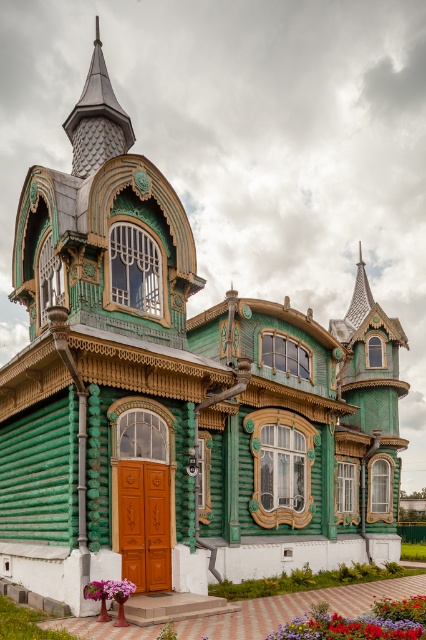
What do you see at coordinates (97, 120) in the screenshot?
I see `shiny dark gray spire at upper center` at bounding box center [97, 120].

Can you confirm if shiny dark gray spire at upper center is shorter than vivid red petals at lower center?

No, shiny dark gray spire at upper center is not shorter than vivid red petals at lower center.

Is point (83, 163) farther from camera compared to point (344, 624)?

Yes, it is behind point (344, 624).

What are the coordinates of `shiny dark gray spire at upper center` in the screenshot? It's located at (97, 120).

Does vivid red petals at lower center appear on the left side of pink matte flower at lower center?

In fact, vivid red petals at lower center is to the right of pink matte flower at lower center.

Is point (379, 605) closer to viewer compared to point (103, 589)?

No, (379, 605) is further to viewer.

Identify the location of vivid red petals at lower center. (359, 621).

Is shiny dark gray spire at upper center bigger than pink matte flower at lower center?

Yes.

The height and width of the screenshot is (640, 426). In order to click on shiny dark gray spire at upper center in this screenshot , I will do `click(97, 120)`.